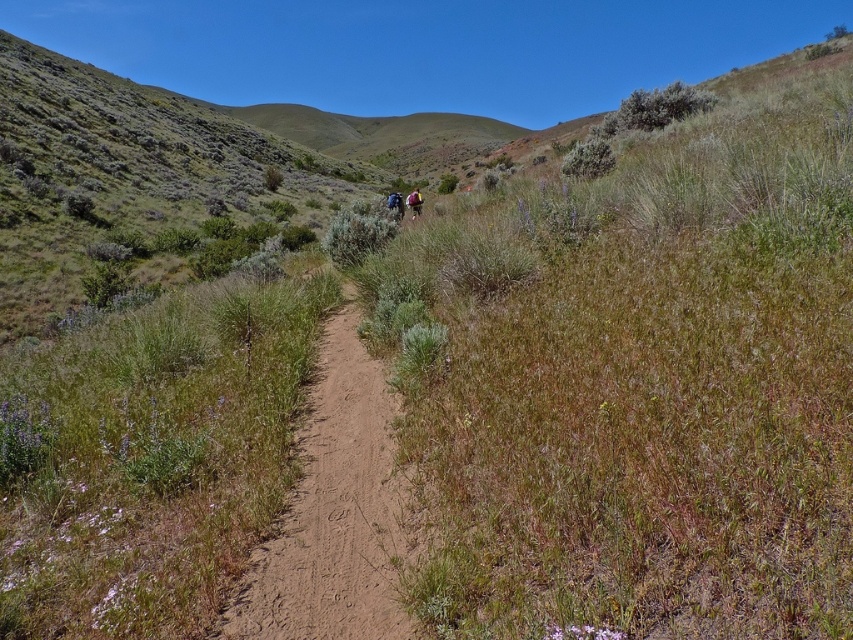
Question: Is camouflage backpack at center thinner than dark blue backpack at center?

Choices:
 (A) yes
 (B) no

Answer: (A)

Question: Among these points, which one is farthest from the camera?

Choices:
 (A) (413, 214)
 (B) (253, 586)

Answer: (A)

Question: Estimate the real-world distances between objects in this image. Which object is farther from the brown dirt path at center?

Choices:
 (A) dark blue backpack at center
 (B) camouflage backpack at center

Answer: (B)

Question: Does brown dirt path at center have a greater width compared to camouflage backpack at center?

Choices:
 (A) yes
 (B) no

Answer: (B)

Question: Estimate the real-world distances between objects in this image. Which object is closer to the dark blue backpack at center?

Choices:
 (A) brown dirt path at center
 (B) camouflage backpack at center

Answer: (B)

Question: Can you confirm if camouflage backpack at center is bigger than dark blue backpack at center?

Choices:
 (A) no
 (B) yes

Answer: (A)